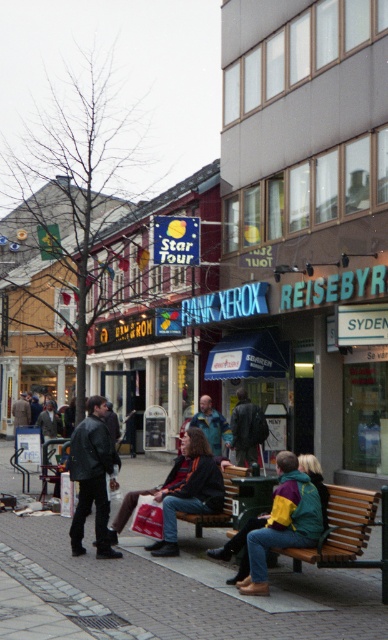
Question: Is brick pavement at lower left bigger than dark gray leather jacket at center?

Choices:
 (A) no
 (B) yes

Answer: (B)

Question: Observing the image, what is the correct spatial positioning of dark gray leather jacket at center in reference to green wooden bench at lower center?

Choices:
 (A) below
 (B) above

Answer: (B)

Question: Is brick pavement at lower left below dark brown leather jacket at center?

Choices:
 (A) no
 (B) yes

Answer: (B)

Question: Among these points, which one is farthest from the camera?

Choices:
 (A) (384, 576)
 (B) (183, 605)
 (C) (181, 515)
 (D) (211, 472)

Answer: (D)

Question: Which object is farther from the camera taking this photo?

Choices:
 (A) green fabric jacket at center
 (B) dark gray leather jacket at center
 (C) brick pavement at lower left
 (D) green wooden bench at lower center

Answer: (A)

Question: Which point is farther from the camera taking this photo?

Choices:
 (A) (192, 442)
 (B) (199, 515)
 (C) (384, 490)
 (D) (329, 589)

Answer: (A)